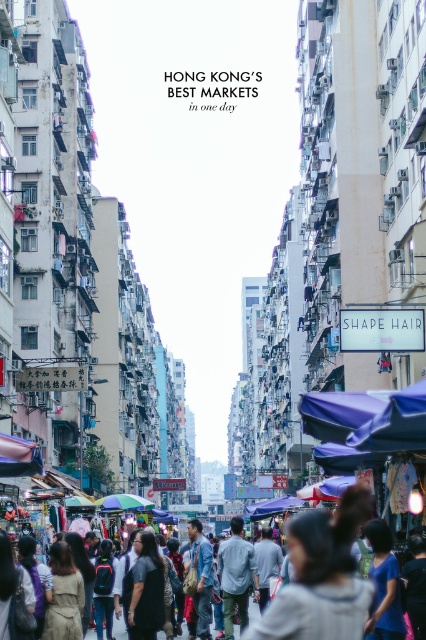
Question: Based on their relative distances, which object is farther from the blue fabric canopy at center?

Choices:
 (A) purple fabric canopy at center
 (B) light gray cotton shirt at center
 (C) blue fabric canopy at lower left

Answer: (B)

Question: Which point is farther from the camera taking this photo?

Choices:
 (A) (154, 506)
 (B) (198, 524)
 (C) (342, 563)

Answer: (A)

Question: Can you confirm if blue fabric canopy at lower left is positioned below purple fabric canopy at center?

Choices:
 (A) no
 (B) yes

Answer: (A)

Question: Where is blue fabric canopy at lower left located in relation to blue fabric canopy at center in the image?

Choices:
 (A) above
 (B) below

Answer: (A)

Question: Does blue denim jacket at center appear on the right side of blue fabric canopy at center?

Choices:
 (A) no
 (B) yes

Answer: (B)

Question: Which point is closer to the camera?

Choices:
 (A) [256, 516]
 (B) [14, 456]

Answer: (B)